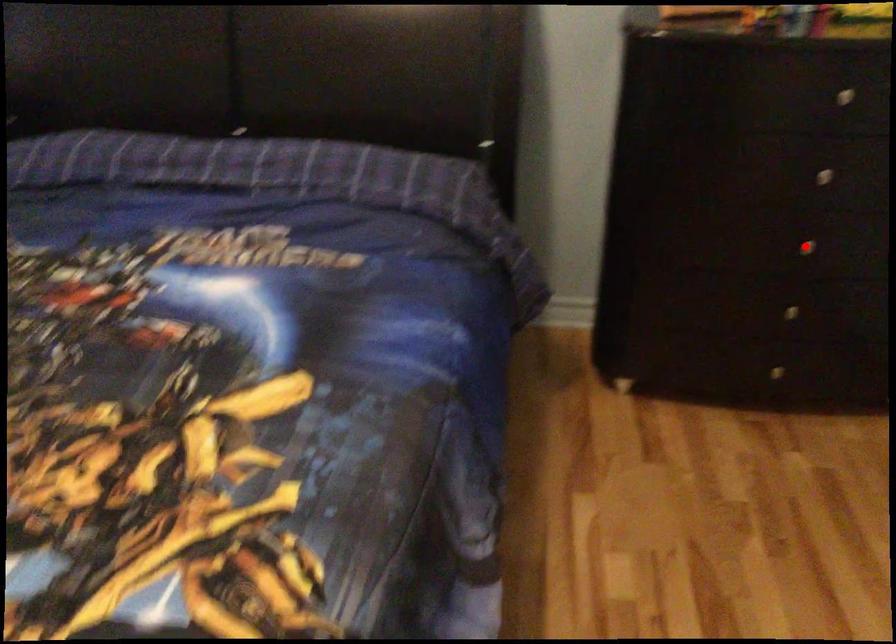
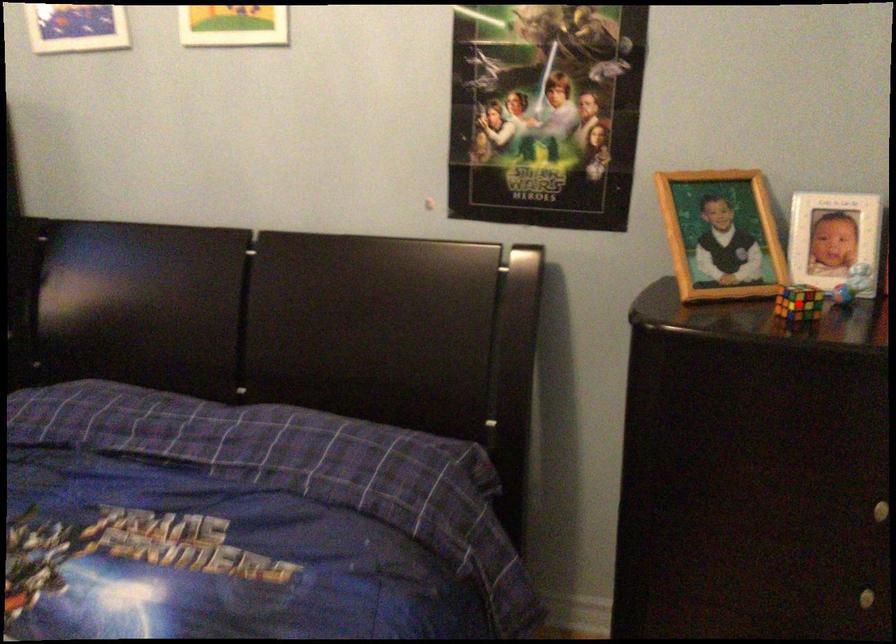
I am providing you with two images of the same scene from different viewpoints. A red point is marked on the first image and another point is marked on the second image. Are the points marked in image1 and image2 representing the same 3D position?

No